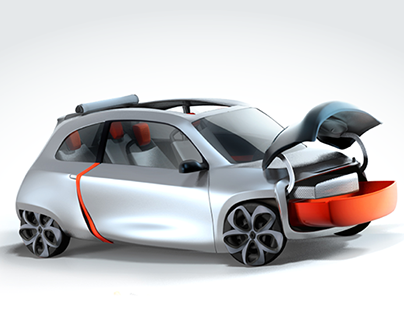
Where is `window`? window is located at coordinates (139, 143), (207, 109), (179, 110), (80, 144).